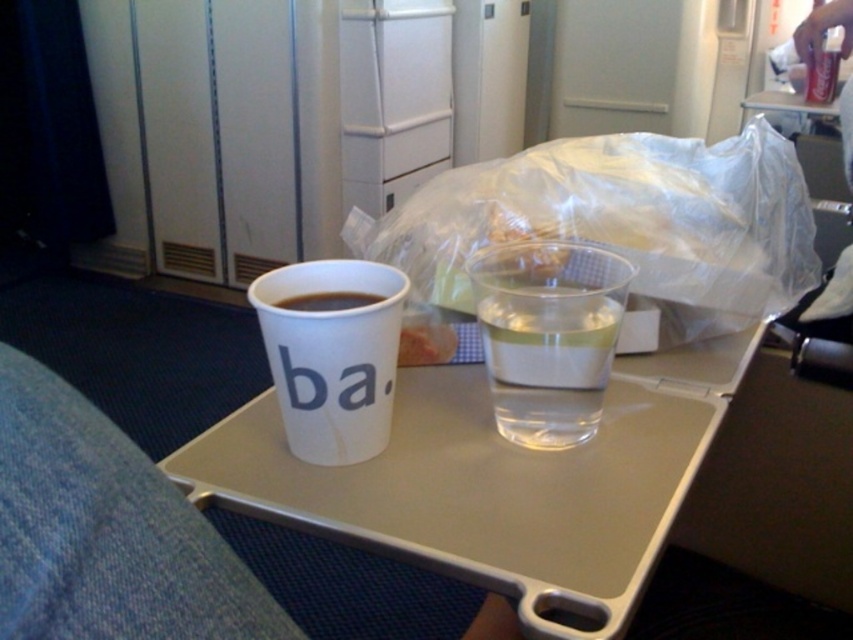
You are a flight attendant checking the tray table of a passenger. You notice the white paper cup at center and the clear plastic cup at center. Which cup is closer to the passenger when looking from the front of the tray?

The clear plastic cup at center is closer to the passenger because the white paper cup at center is behind it.

You are a flight attendant checking the tray table of a passenger. You see the white paper cup at upper center and the white paper cup at center on the tray. Which cup is located lower on the tray?

The white paper cup at upper center is below the white paper cup at center, so the white paper cup at upper center is located lower on the tray.